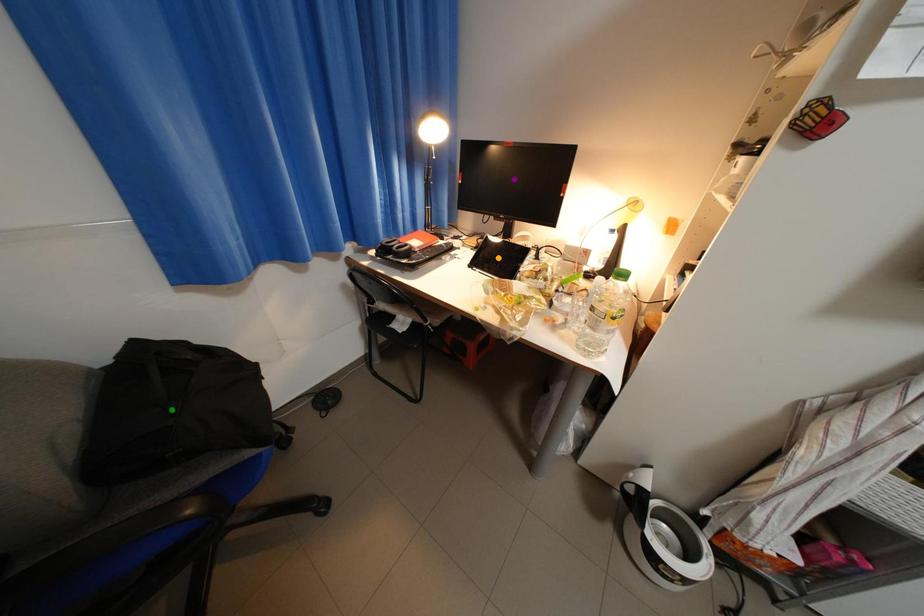
Order these from nearest to farthest:
A) green point
B) purple point
C) orange point

green point, orange point, purple point